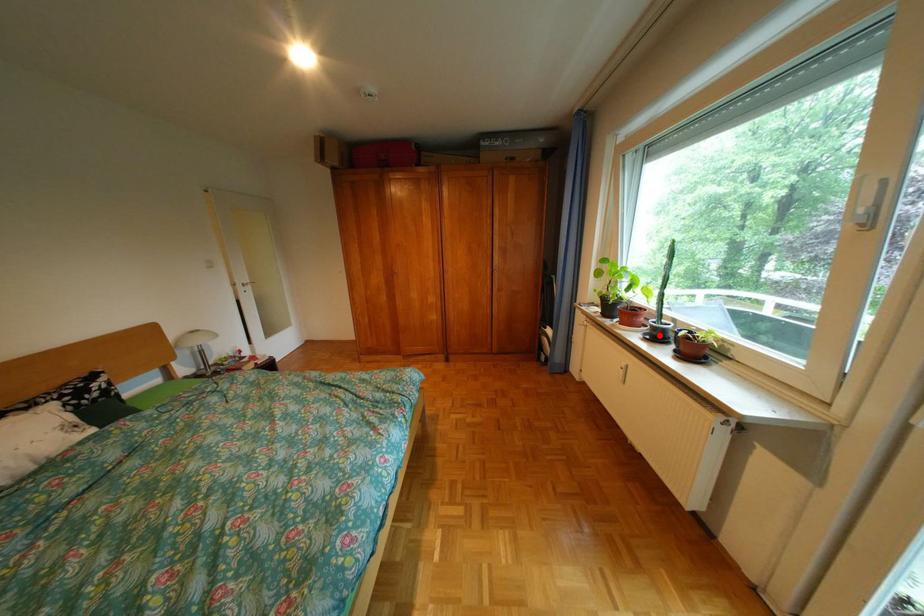
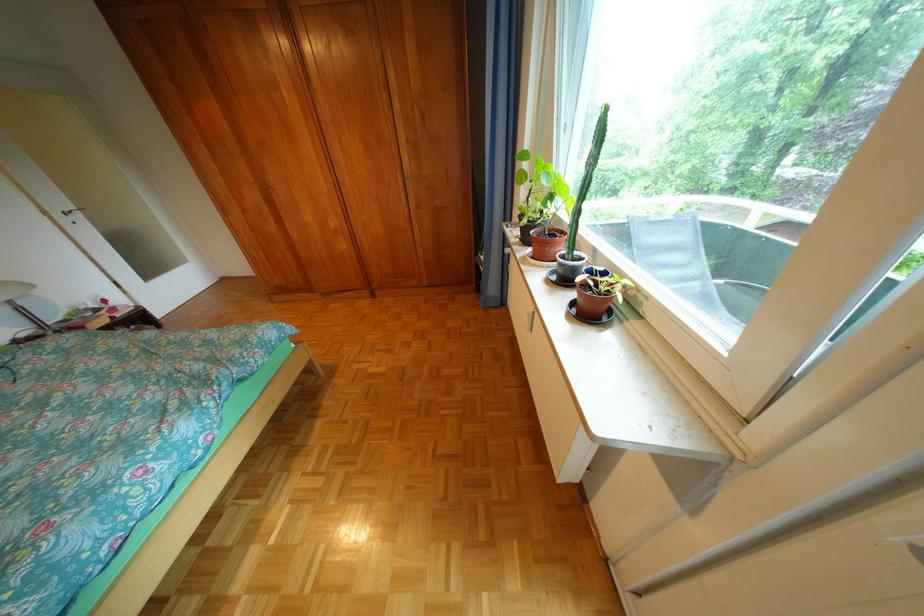
In the second image, find the point that corresponds to the highlighted location in the first image.

(566, 273)